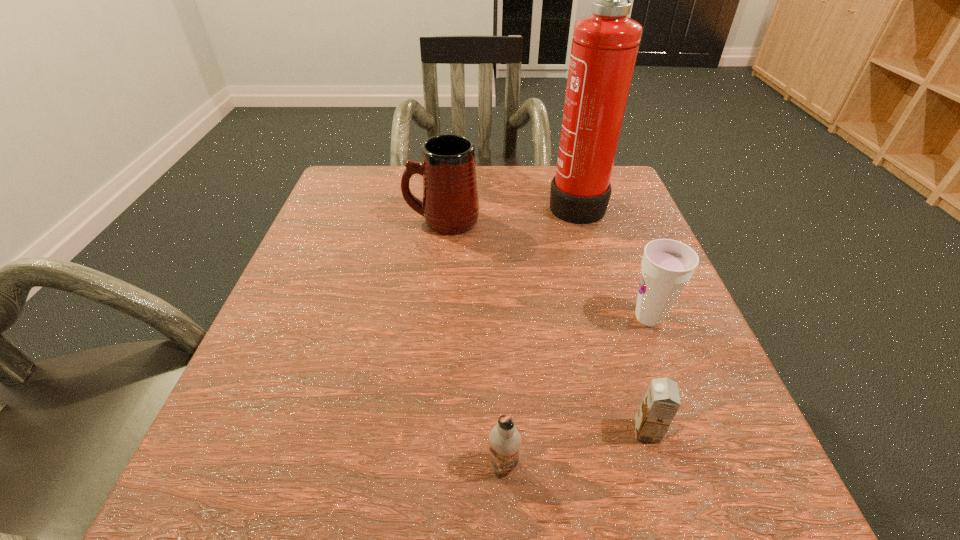
Identify the location of blank region between the tallest object and the nearest object. (540, 333).

Where is `blank region between the mug and the fire extinguisher`? blank region between the mug and the fire extinguisher is located at coordinates (509, 212).

Identify the location of vacant space that's between the second object from left to right and the leftmost object. Image resolution: width=960 pixels, height=540 pixels. (473, 342).

Where is `empty location between the nearer chocolate milk and the farther chocolate milk`? The width and height of the screenshot is (960, 540). empty location between the nearer chocolate milk and the farther chocolate milk is located at coordinates (575, 448).

Image resolution: width=960 pixels, height=540 pixels. I want to click on vacant space that's between the fourth farthest object and the tallest object, so click(x=612, y=316).

Find the location of a particular element. This screenshot has height=540, width=960. free area in between the second nearest object and the mug is located at coordinates (544, 326).

You are a GUI agent. You are given a task and a screenshot of the screen. Output one action in this format:
    pyautogui.click(x=<x>, y=<y>)
    Task: Click on the free space between the left chocolate milk and the cup
    This screenshot has width=960, height=540.
    Given the screenshot: What is the action you would take?
    pyautogui.click(x=576, y=391)

I want to click on unoccupied area between the fire extinguisher and the farther chocolate milk, so 612,316.

You are a GUI agent. You are given a task and a screenshot of the screen. Output one action in this format:
    pyautogui.click(x=<x>, y=<y>)
    Task: Click on the free space between the tallest object and the cup
    
    Given the screenshot: What is the action you would take?
    pyautogui.click(x=612, y=260)

Identify the location of vacant region between the fire extinguisher and the left chocolate milk. This screenshot has width=960, height=540. (540, 333).